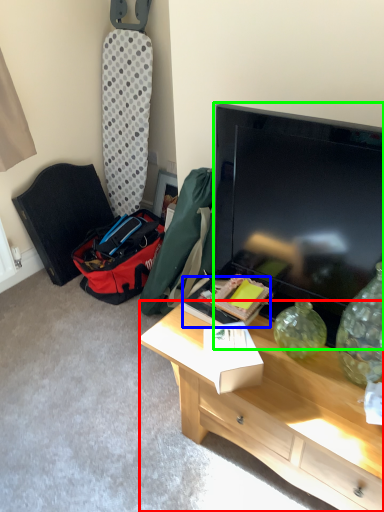
Question: Based on their relative distances, which object is farther from desk (highlighted by a red box)? Choose from box (highlighted by a blue box) and television (highlighted by a green box).

Choices:
 (A) box
 (B) television

Answer: (B)